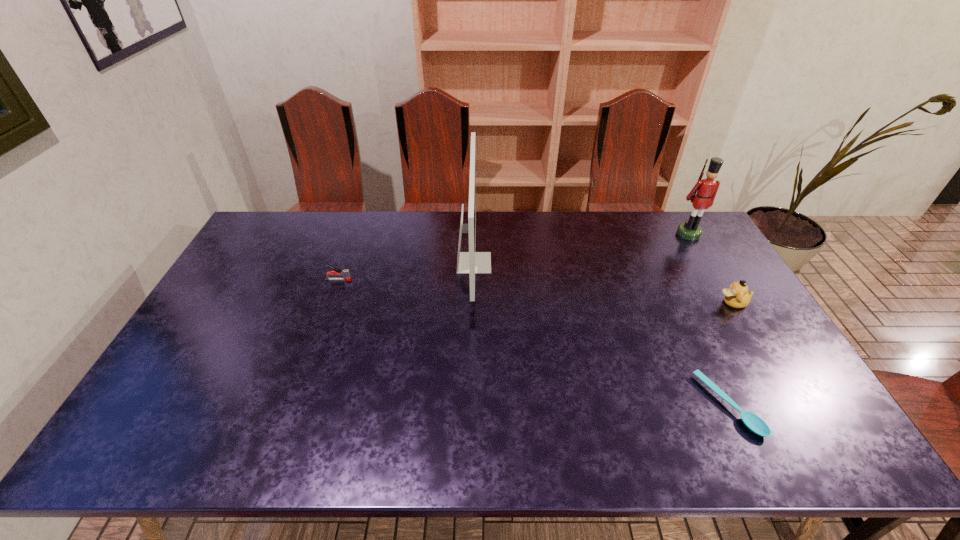
Find the location of a particular element. The image size is (960, 540). free space that satisfies the following two spatial constraints: 1. on the front-facing side of the nutcracker; 2. on the front-facing side of the monitor is located at coordinates (706, 263).

The height and width of the screenshot is (540, 960). I want to click on vacant point that satisfies the following two spatial constraints: 1. on the front-facing side of the third object from left to right; 2. on the right side of the fourth object from right to left, so click(x=472, y=405).

I want to click on free space in the image that satisfies the following two spatial constraints: 1. on the front-facing side of the nutcracker; 2. on the handle side of the stapler, so click(715, 280).